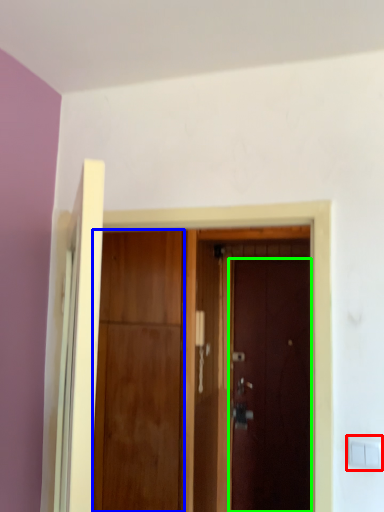
Question: Based on their relative distances, which object is farther from light switch (highlighted by a red box)? Choose from door (highlighted by a blue box) and door (highlighted by a green box).

Choices:
 (A) door
 (B) door

Answer: (B)